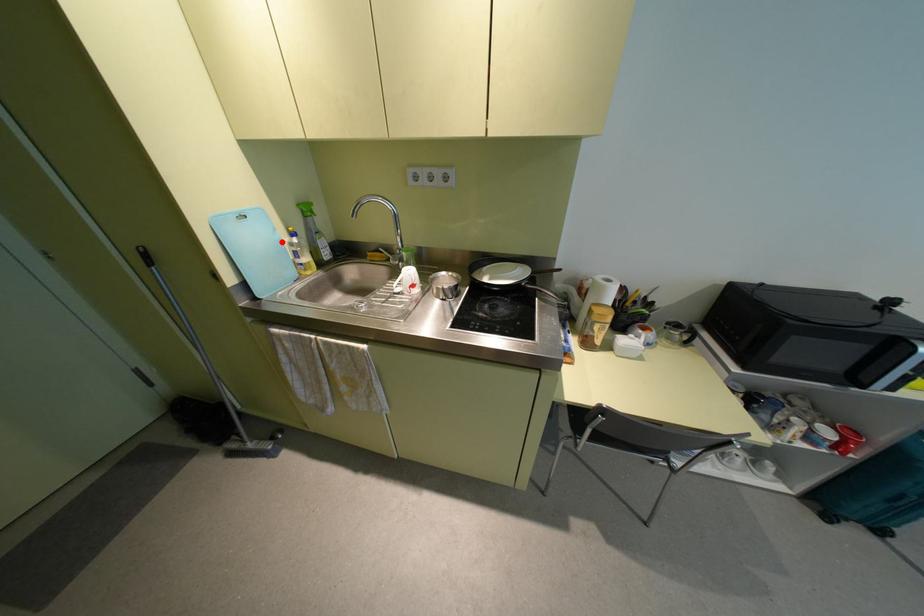
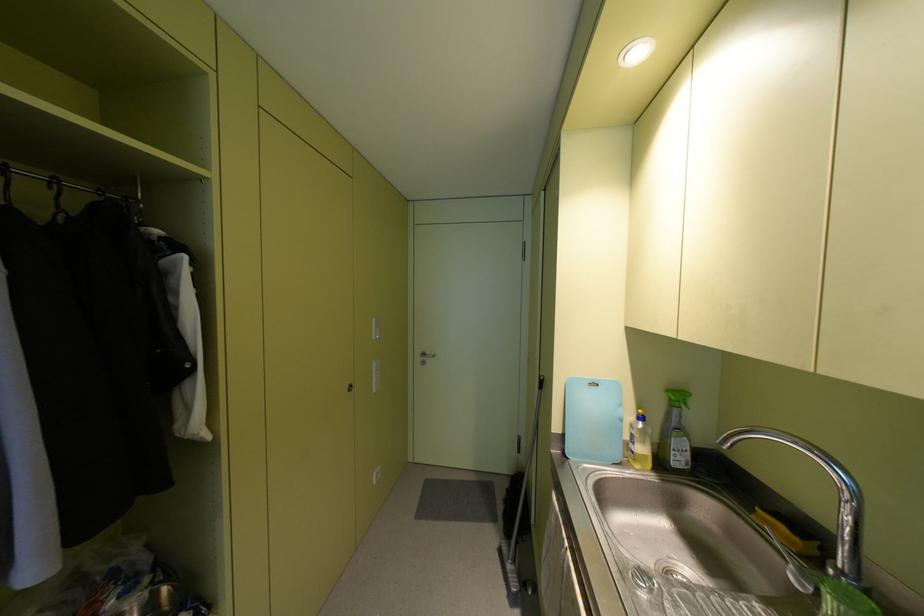
Locate, in the second image, the point that corresponds to the highlighted location in the first image.

(621, 419)